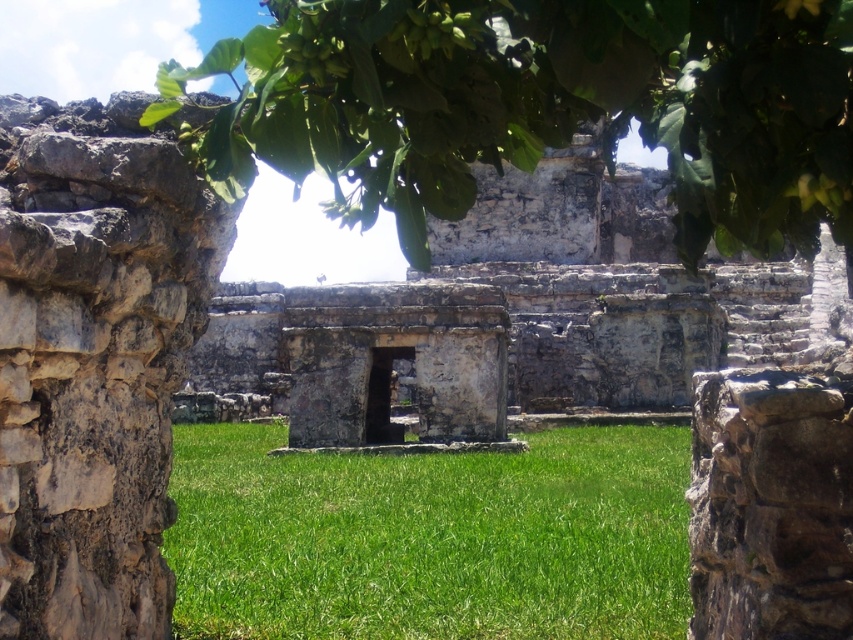
Question: Is green leafy tree at upper center closer to the viewer compared to green grass at center?

Choices:
 (A) yes
 (B) no

Answer: (A)

Question: Can you confirm if green leafy tree at upper center is positioned below green grass at center?

Choices:
 (A) no
 (B) yes

Answer: (A)

Question: Which point appears closest to the camera in this image?

Choices:
 (A) [x=401, y=550]
 (B) [x=253, y=166]

Answer: (B)

Question: Which point is farther to the camera?

Choices:
 (A) green grass at center
 (B) green leafy tree at upper center

Answer: (A)

Question: Does green leafy tree at upper center come in front of green grass at center?

Choices:
 (A) yes
 (B) no

Answer: (A)